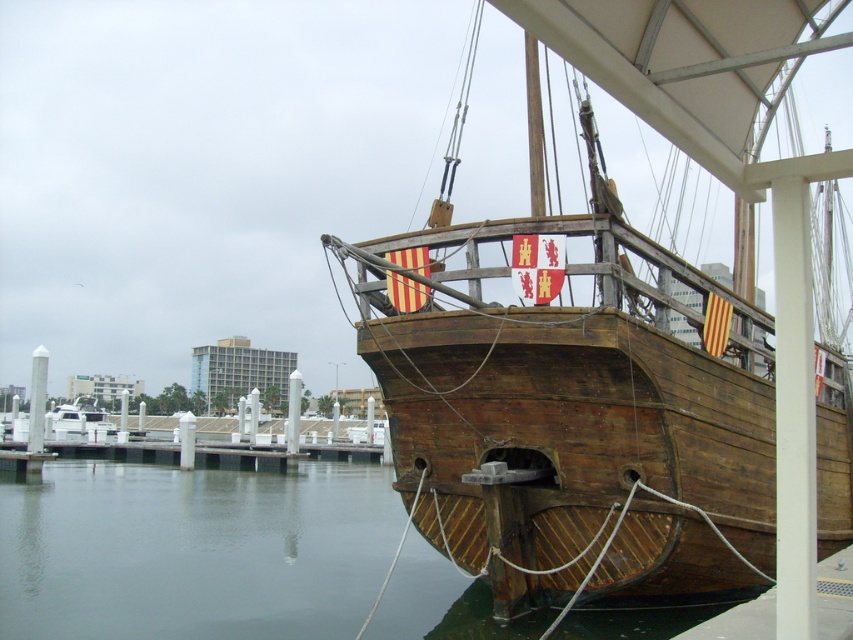
Question: Which of the following is the farthest from the observer?

Choices:
 (A) (273, 516)
 (B) (540, 552)

Answer: (A)

Question: Does wooden ship at center appear on the right side of wooden water at lower left?

Choices:
 (A) yes
 (B) no

Answer: (A)

Question: Which of the following is the closest to the observer?

Choices:
 (A) click(x=62, y=625)
 (B) click(x=804, y=278)

Answer: (B)

Question: Is wooden ship at center to the right of wooden water at lower left from the viewer's perspective?

Choices:
 (A) yes
 (B) no

Answer: (A)

Question: Which point is farther to the camera?

Choices:
 (A) wooden ship at center
 (B) wooden water at lower left

Answer: (B)

Question: Is wooden ship at center in front of wooden water at lower left?

Choices:
 (A) no
 (B) yes

Answer: (B)